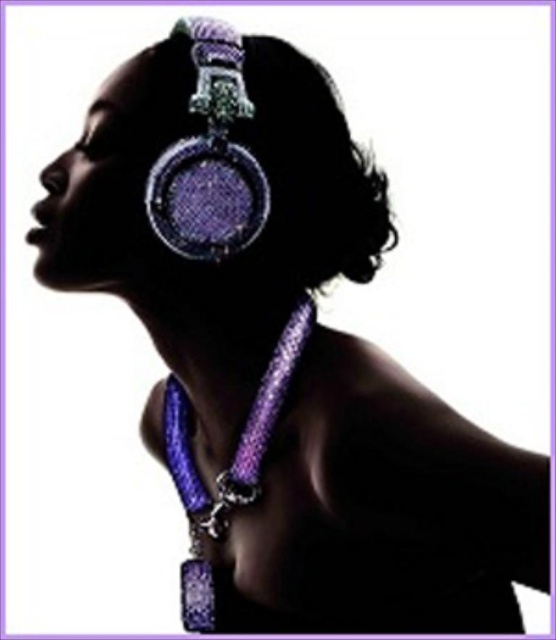
Question: Among these objects, which one is nearest to the camera?

Choices:
 (A) sparkly purple earring at upper center
 (B) purple mesh necklace at center
 (C) purple shiny necklace at center

Answer: (A)

Question: Is shiny purple hair at upper center in front of sparkly purple earring at upper center?

Choices:
 (A) yes
 (B) no

Answer: (A)

Question: Does shiny purple hair at upper center appear on the right side of purple mesh necklace at center?

Choices:
 (A) no
 (B) yes

Answer: (B)

Question: Which point appears farthest from the camera in this image?

Choices:
 (A) (240, 465)
 (B) (237, 189)
 (C) (181, 29)

Answer: (C)

Question: Which object is the farthest from the purple mesh necklace at center?

Choices:
 (A) purple shiny necklace at center
 (B) sparkly purple earring at upper center

Answer: (B)

Question: Is sparkly purple earring at upper center to the left of purple shiny necklace at center from the viewer's perspective?

Choices:
 (A) no
 (B) yes

Answer: (A)